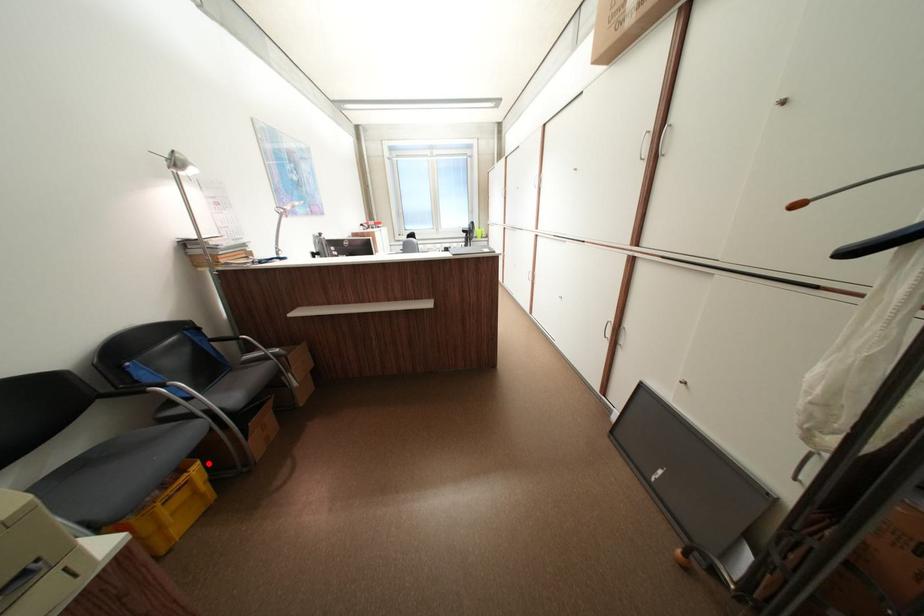
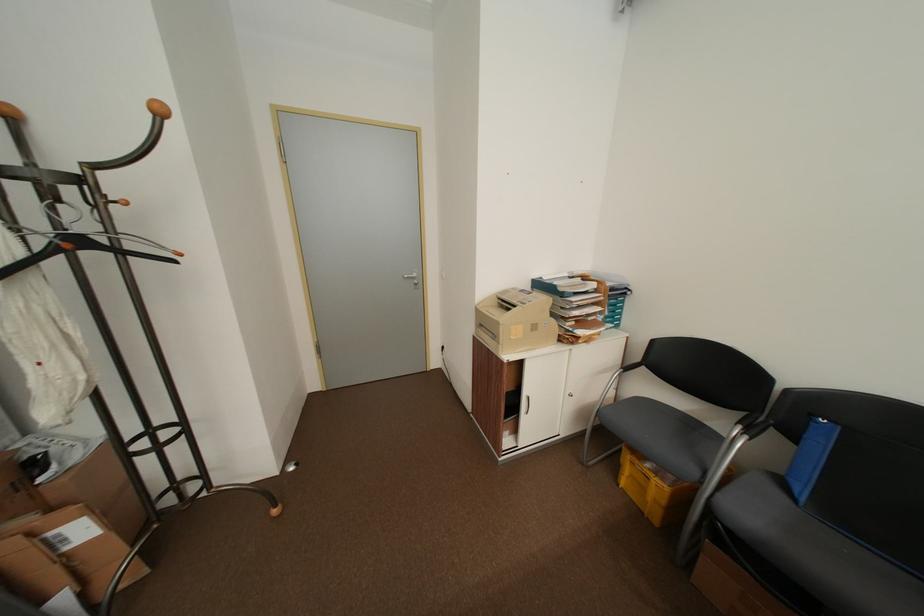
Question: A red point is marked in image1. In image2, is the corresponding 3D point closer to the camera or farther? Reply with the corresponding letter.

Choices:
 (A) The corresponding 3D point is closer.
 (B) The corresponding 3D point is farther.

Answer: (B)